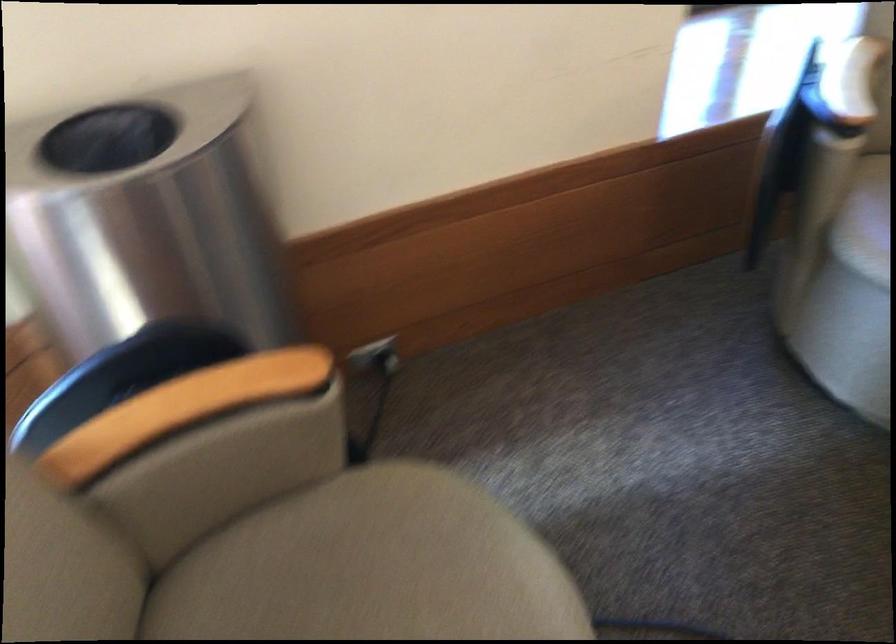
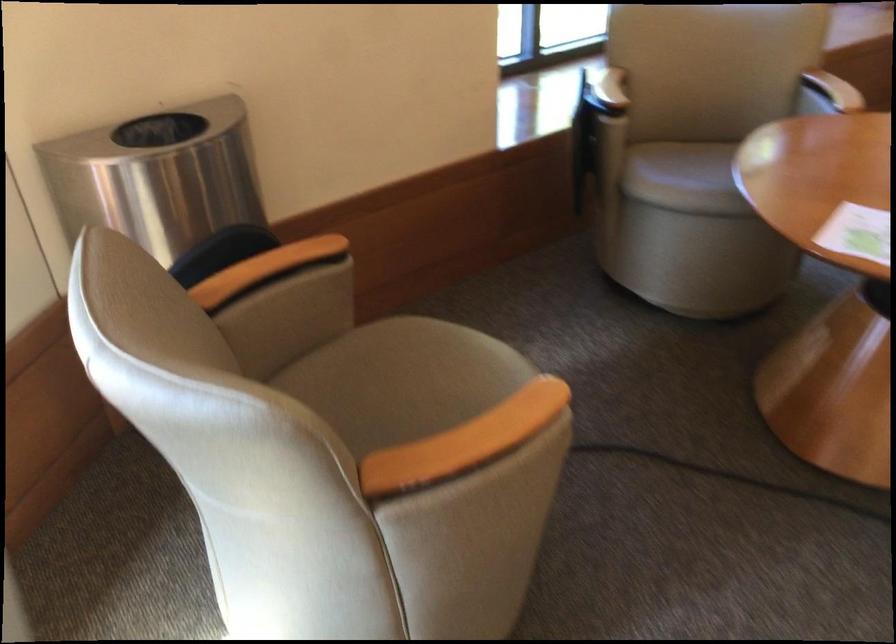
The images are taken continuously from a first-person perspective. In which direction are you moving?

The movement direction of the cameraman is left, backward.